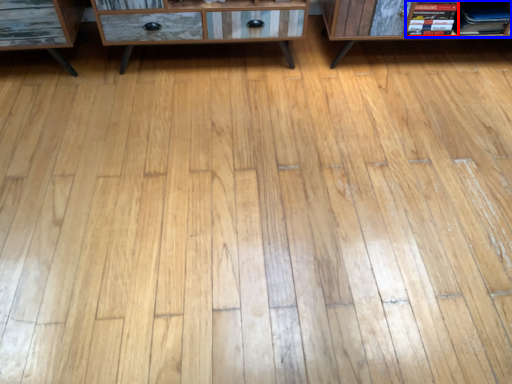
Question: Which object appears closest to the camera in this image, book (highlighted by a red box) or book (highlighted by a blue box)?

Choices:
 (A) book
 (B) book

Answer: (A)